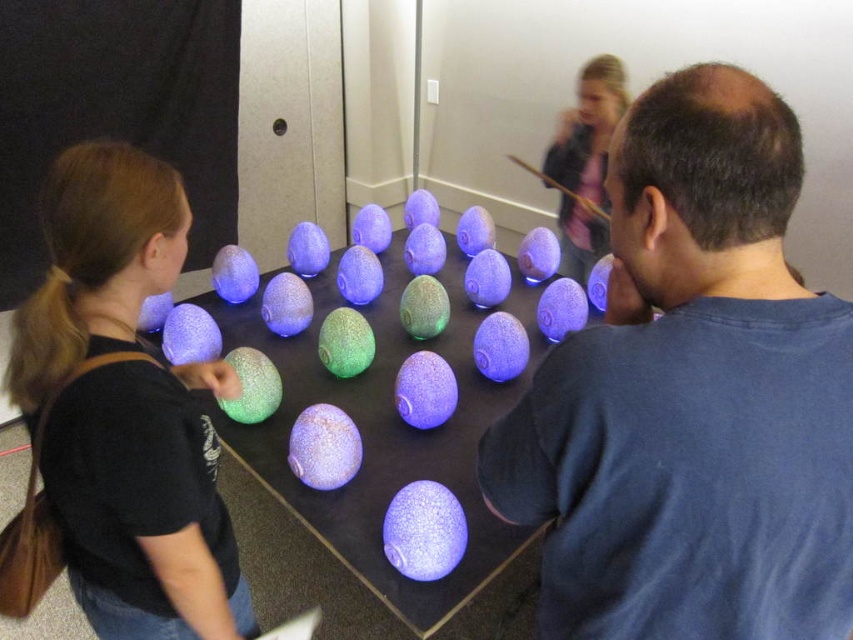
Question: Based on their relative distances, which object is nearer to the matte black shirt at center?

Choices:
 (A) matte black jacket at upper center
 (B) speckled glass eggs at center

Answer: (B)

Question: Which of the following is the farthest from the observer?

Choices:
 (A) (403, 444)
 (B) (68, 362)

Answer: (A)

Question: Is speckled glass eggs at center smaller than matte black jacket at upper center?

Choices:
 (A) yes
 (B) no

Answer: (B)

Question: Does matte blue egg at center appear under speckled glass eggs at center?

Choices:
 (A) yes
 (B) no

Answer: (A)

Question: Observing the image, what is the correct spatial positioning of matte blue egg at center in reference to matte black shirt at center?

Choices:
 (A) below
 (B) above

Answer: (B)

Question: Which point is closer to the camera?

Choices:
 (A) matte black shirt at center
 (B) matte black jacket at upper center
 (C) matte blue egg at center
 (D) speckled glass eggs at center

Answer: (C)